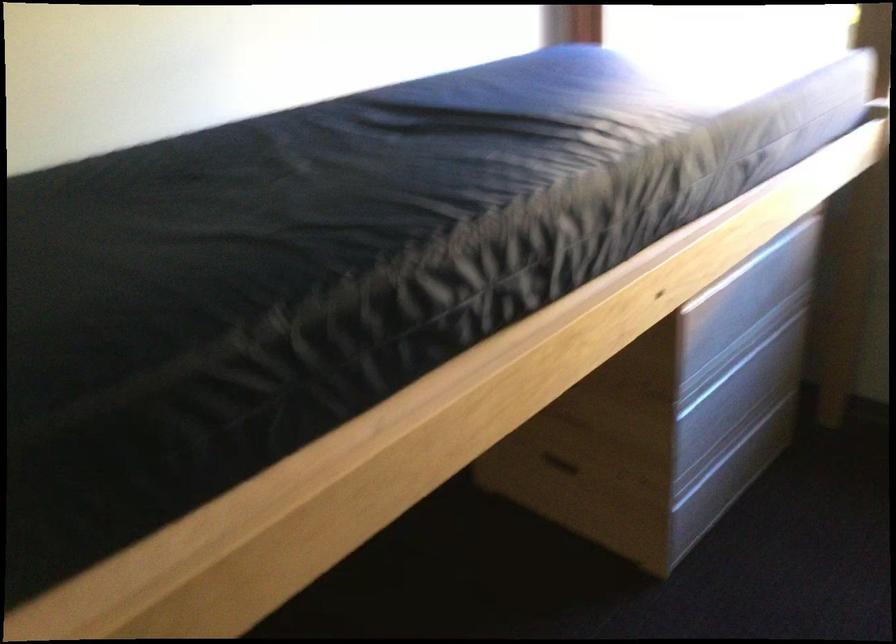
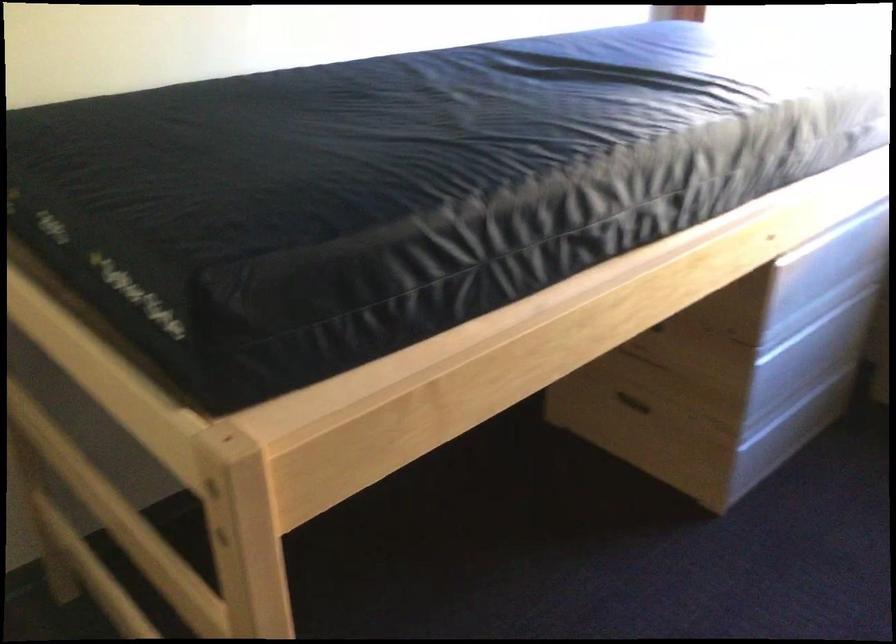
Question: Based on the continuous images, in which direction is the camera rotating? Reply with the corresponding letter.

Choices:
 (A) Left
 (B) Right
 (C) Up
 (D) Down

Answer: (A)